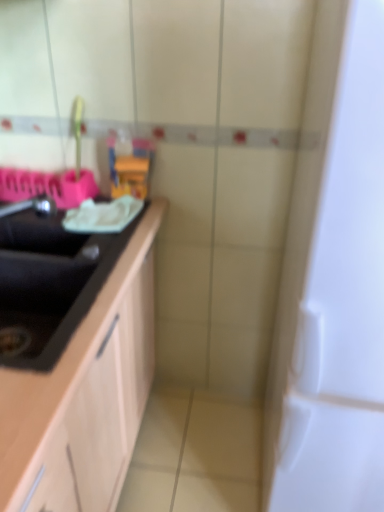
Question: Is point (29, 242) closer or farther from the camera than point (127, 169)?

Choices:
 (A) farther
 (B) closer

Answer: (B)

Question: From a real-world perspective, relative to translucent plastic toy at center, is black matte sink at left vertically above or below?

Choices:
 (A) below
 (B) above

Answer: (A)

Question: Estimate the real-world distances between objects in this image. Which object is farther from the black matte countertop at left?

Choices:
 (A) translucent plastic toy at center
 (B) white glossy door at right
 (C) black matte sink at left

Answer: (A)

Question: Which object is the closest to the white glossy door at right?

Choices:
 (A) black matte sink at left
 (B) translucent plastic toy at center
 (C) black matte countertop at left

Answer: (C)